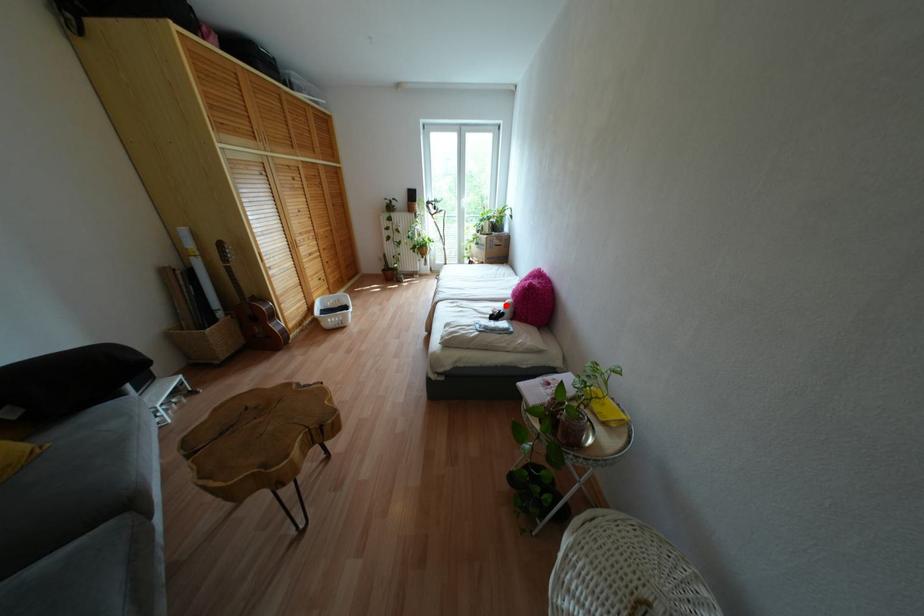
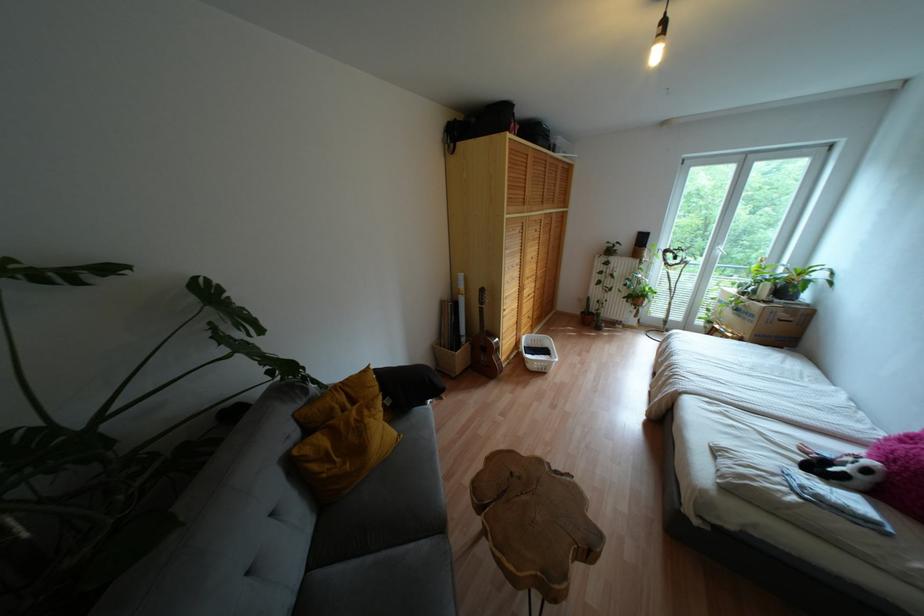
Locate, in the second image, the point that corresponds to the highlighted location in the first image.

(867, 471)